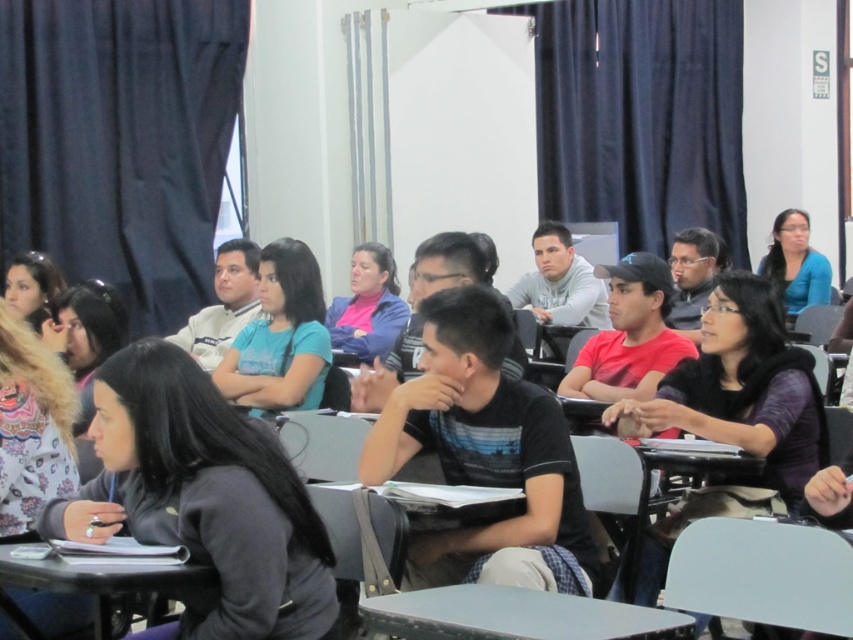
In the scene shown: You are standing at the entrance of the classroom and want to walk directly to the smooth gray table at center. Which direction should you walk to reach it?

Since the smooth gray table at center is positioned at point 0.963 on the x axis and 0.605 on the y axis, you should walk towards the center of the room to reach it.

Based on the photo, you are standing at the front of the classroom and want to move to the back. Which point, point (x=479, y=588) or point (x=91, y=576), is closer to the back wall?

Point (x=479, y=588) is behind point (x=91, y=576), so it is closer to the back wall.